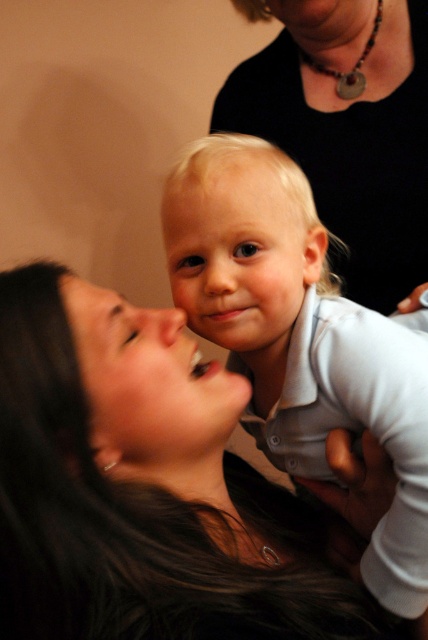
Question: Considering the relative positions of smooth black hair at center and black matte shirt at upper center in the image provided, where is smooth black hair at center located with respect to black matte shirt at upper center?

Choices:
 (A) below
 (B) above

Answer: (A)

Question: Based on their relative distances, which object is nearer to the blonde hair at center?

Choices:
 (A) black matte shirt at upper center
 (B) smooth black hair at center

Answer: (B)

Question: Which object is positioned farthest from the black matte shirt at upper center?

Choices:
 (A) blonde hair at center
 (B) smooth black hair at center

Answer: (B)

Question: Does smooth black hair at center appear over black matte shirt at upper center?

Choices:
 (A) no
 (B) yes

Answer: (A)

Question: Which point is closer to the camera?

Choices:
 (A) smooth black hair at center
 (B) black matte shirt at upper center

Answer: (A)

Question: Can you confirm if smooth black hair at center is positioned to the right of black matte shirt at upper center?

Choices:
 (A) yes
 (B) no

Answer: (B)